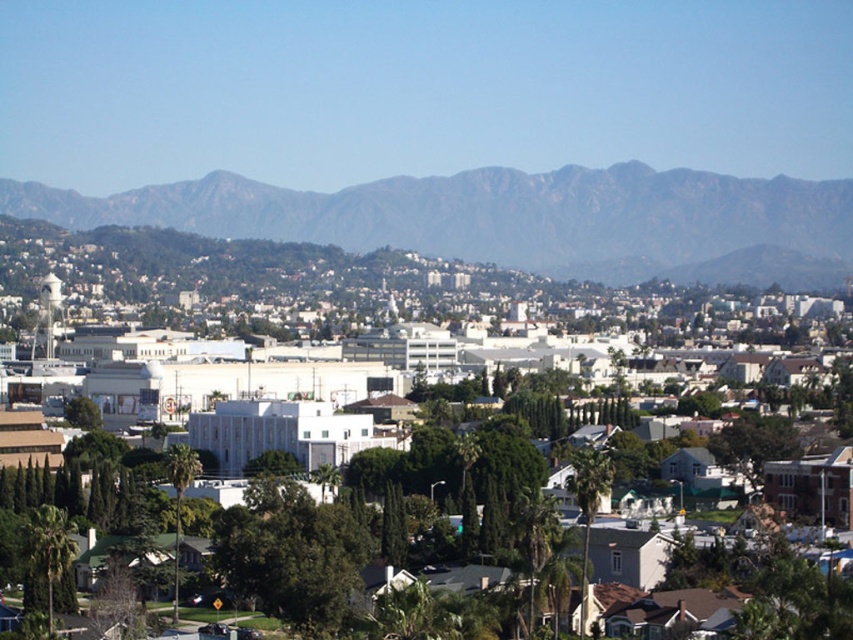
Question: Is green leafy palm tree at center further to the viewer compared to green leafy tree at lower left?

Choices:
 (A) yes
 (B) no

Answer: (B)

Question: Which object is positioned farthest from the gray rocky mountain at upper center?

Choices:
 (A) white matte building at center
 (B) green leafy palm tree at lower left
 (C) green leafy tree at center
 (D) green leafy palm tree at center

Answer: (C)

Question: Can you confirm if green leafy palm tree at lower left is positioned to the right of green leafy tree at lower left?

Choices:
 (A) yes
 (B) no

Answer: (B)

Question: Is gray rocky mountain at upper center further to the viewer compared to green leafy palm tree at lower left?

Choices:
 (A) no
 (B) yes

Answer: (B)

Question: Considering the real-world distances, which object is closest to the green leafy palm tree at center?

Choices:
 (A) green leafy palm tree at lower left
 (B) gray rocky mountain at upper center

Answer: (A)

Question: Which point is farther from the camera taking this photo?

Choices:
 (A) [604, 458]
 (B) [164, 236]

Answer: (B)